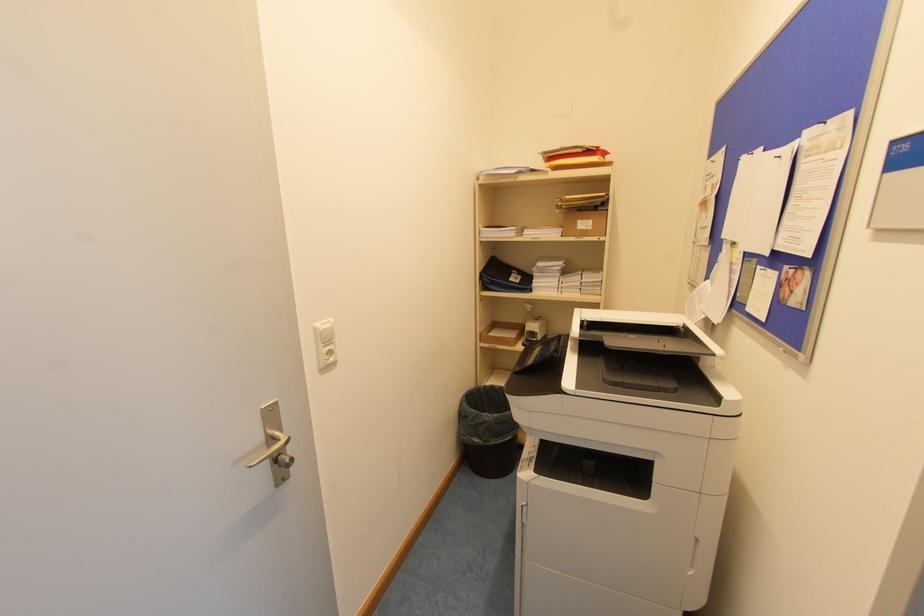
Where would you lift the black trash bag? Please return your answer as a coordinate pair (x, y).

(488, 431)